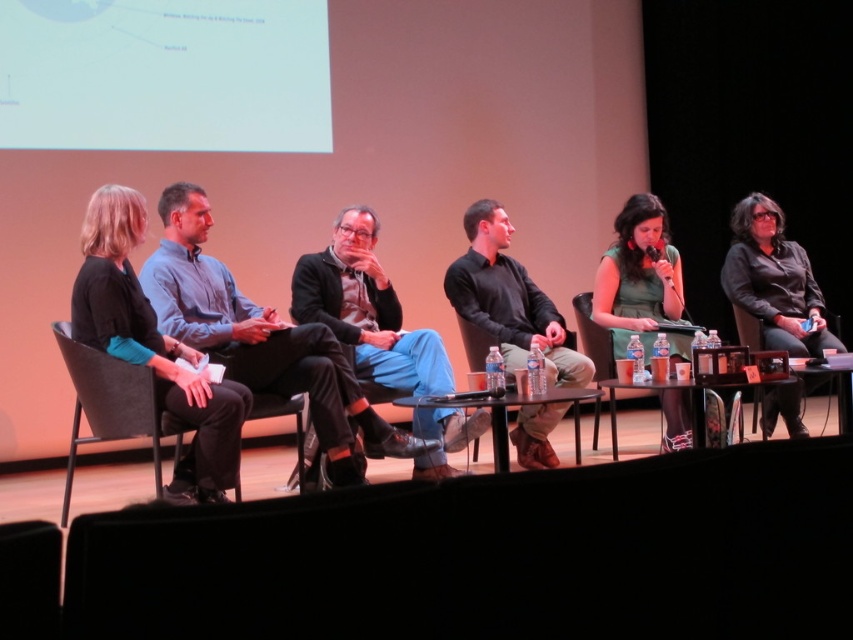
Is black leather chair at left bigger than black leather chair at center?

Yes, black leather chair at left is bigger than black leather chair at center.

Which of these two, black leather chair at left or black leather chair at center, stands shorter?

With less height is black leather chair at left.

Does point (131, 422) come behind point (596, 324)?

No, it is in front of (596, 324).

Where is `black leather chair at left`? black leather chair at left is located at coordinates (x=112, y=404).

Which is more to the left, black fabric pants at left or black leather chair at left?

Positioned to the left is black leather chair at left.

Is black fabric pants at left smaller than black leather chair at left?

Incorrect, black fabric pants at left is not smaller in size than black leather chair at left.

Locate an element on the screen. This screenshot has width=853, height=640. black fabric pants at left is located at coordinates [154, 346].

Locate an element on the screen. black fabric pants at left is located at coordinates (154, 346).

Does black fabric pants at left lie behind black leather chair at right?

No, black fabric pants at left is in front of black leather chair at right.

The image size is (853, 640). In order to click on black fabric pants at left in this screenshot , I will do `click(154, 346)`.